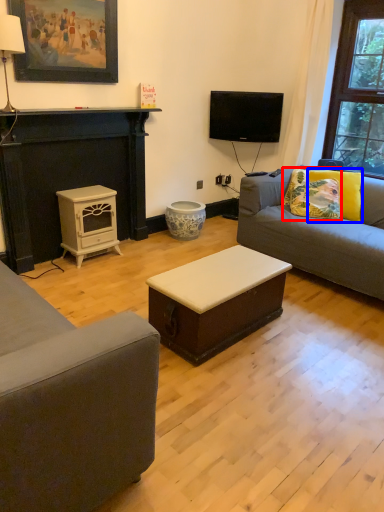
Question: Which of the following is the farthest to the observer, pillow (highlighted by a red box) or pillow (highlighted by a blue box)?

Choices:
 (A) pillow
 (B) pillow

Answer: (A)